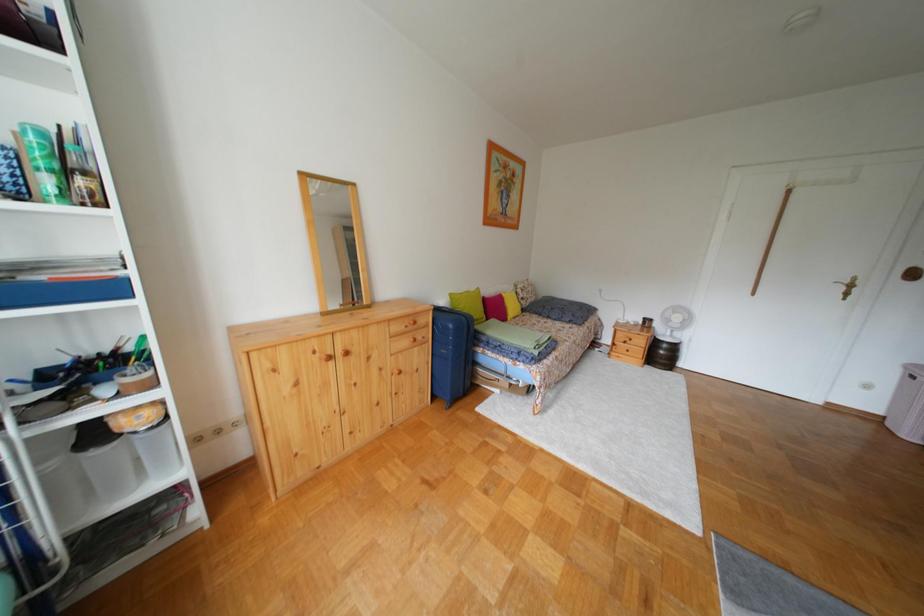
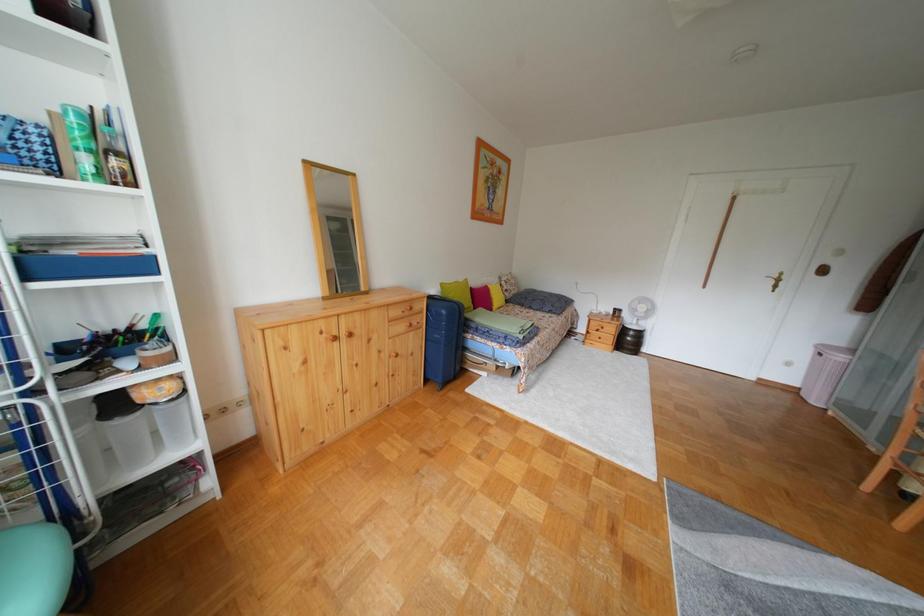
The images are taken continuously from a first-person perspective. In which direction are you moving?

The movement direction of the cameraman is left, backward.